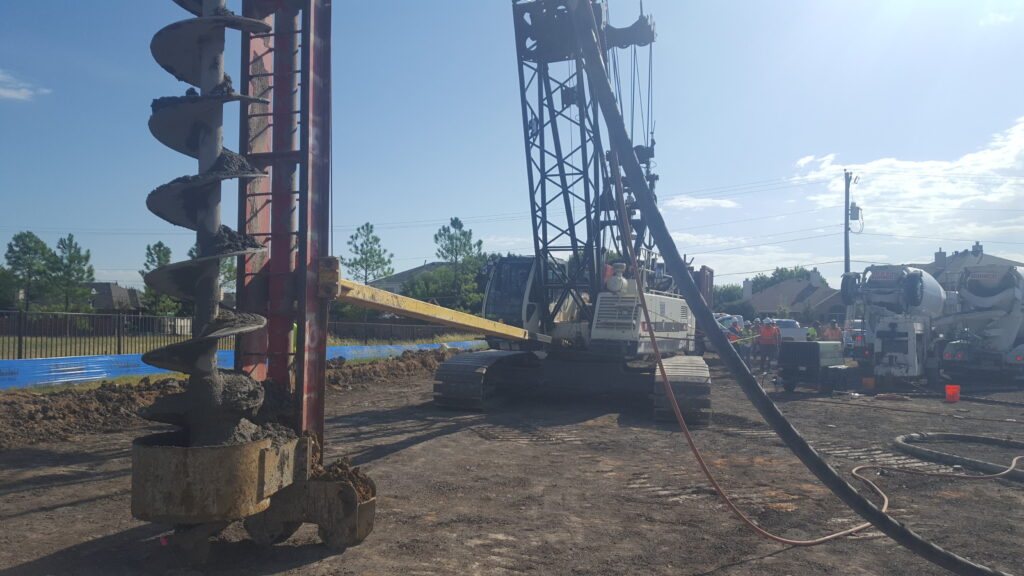
The image size is (1024, 576). I want to click on cable, so click(599, 87), click(697, 303), click(815, 461).